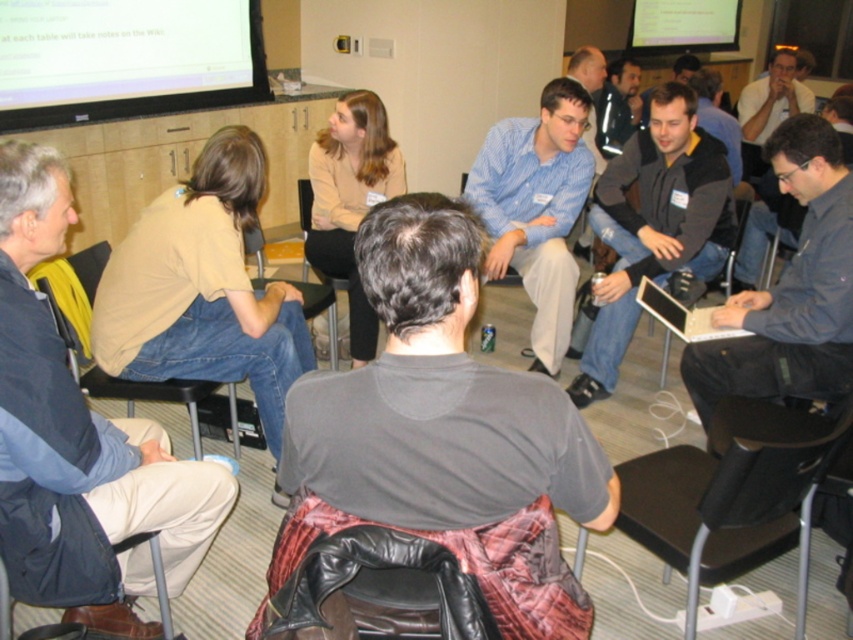
Does black plastic chair at lower right appear on the right side of leather at lower left?

Yes, black plastic chair at lower right is to the right of leather at lower left.

Is black plastic chair at lower right wider than leather at lower left?

Yes.

Between point (808, 552) and point (160, 566), which one is positioned in front?

Point (160, 566) is in front.

You are a GUI agent. You are given a task and a screenshot of the screen. Output one action in this format:
    pyautogui.click(x=<x>, y=<y>)
    Task: Click on the black plastic chair at lower right
    Image resolution: width=853 pixels, height=640 pixels.
    Given the screenshot: What is the action you would take?
    pyautogui.click(x=732, y=496)

Is black leather chair at lower left above black leather chair at center?

Incorrect, black leather chair at lower left is not positioned above black leather chair at center.

Can you confirm if black leather chair at lower left is wider than black leather chair at center?

Yes, black leather chair at lower left is wider than black leather chair at center.

Where is `black leather chair at lower left`? The height and width of the screenshot is (640, 853). black leather chair at lower left is located at coordinates (119, 378).

Which is below, dark gray shirt at center or leather at lower left?

leather at lower left is lower down.

Which is above, dark gray shirt at center or leather at lower left?

dark gray shirt at center

Between point (741, 308) and point (57, 634), which one is positioned behind?

The point (741, 308) is behind.

Where is `dark gray shirt at center`? The width and height of the screenshot is (853, 640). dark gray shirt at center is located at coordinates (790, 291).